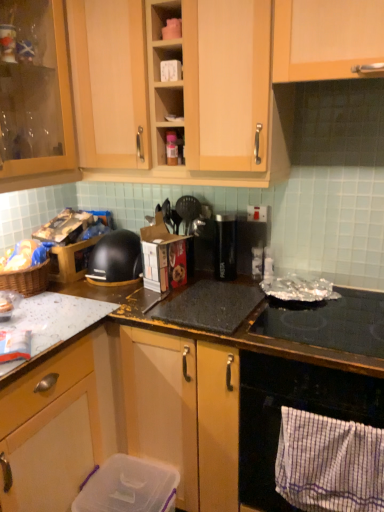
Question: In terms of height, does black glass oven at lower right look taller or shorter compared to matte brown chips in basket at left?

Choices:
 (A) tall
 (B) short

Answer: (A)

Question: Considering their positions, is black glass oven at lower right located in front of or behind matte brown chips in basket at left?

Choices:
 (A) behind
 (B) front

Answer: (B)

Question: Estimate the real-world distances between objects in this image. Which object is closer to the white matte cup at upper center?

Choices:
 (A) black matte bowl at center-left
 (B) black glass oven at lower right
 (C) black granite countertop at center
 (D) clear plastic container at lower center, the fourth appliance from the top
 (E) shiny black glass at lower right

Answer: (A)

Question: Considering the real-world distances, which object is closest to the white striped towel at lower right?

Choices:
 (A) matte brown chips in basket at left
 (B) light wood cabinet at upper center, acting as the 1th cabinetry starting from the right
 (C) black plastic toaster at center, which is the 2th appliance from bottom to top
 (D) black glass oven at lower right
 (E) black matte bowl at center-left

Answer: (D)